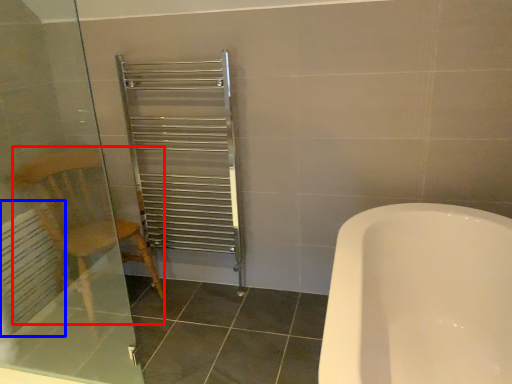
Question: Which of the following is the farthest to the observer, armchair (highlighted by a red box) or radiator (highlighted by a blue box)?

Choices:
 (A) armchair
 (B) radiator

Answer: (B)